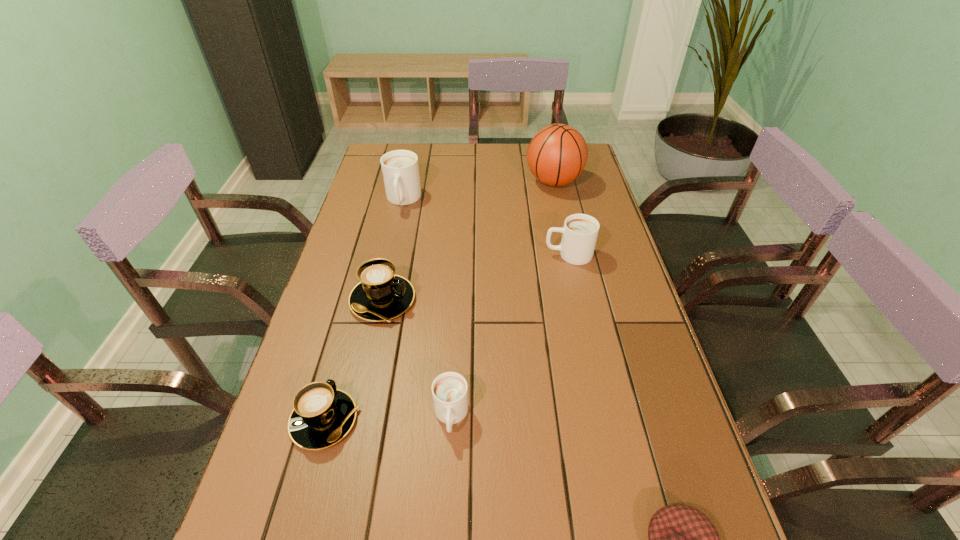
Locate an element on the screen. cappuccino situated at the right edge is located at coordinates (580, 231).

In order to click on object at the far right corner in this screenshot , I will do `click(557, 154)`.

Locate an element on the screen. vacant space at the far edge is located at coordinates (494, 171).

Image resolution: width=960 pixels, height=540 pixels. Find the location of `free space at the left edge`. free space at the left edge is located at coordinates (374, 250).

What are the coordinates of `free space at the right edge of the desktop` in the screenshot? It's located at (588, 306).

The height and width of the screenshot is (540, 960). In the image, there is a desktop. Identify the location of vacant space at the far left corner. (379, 154).

Where is `empty space between the farthest cappuccino and the third farthest object`? empty space between the farthest cappuccino and the third farthest object is located at coordinates (486, 227).

At what (x,y) coordinates should I click in order to perform the action: click on unoccupied position between the third nearest cappuccino and the third farthest object. Please return your answer as a coordinate pair (x, y). Looking at the image, I should click on (475, 278).

Where is `object that stands as the sixth closest to the tallest object`? The image size is (960, 540). object that stands as the sixth closest to the tallest object is located at coordinates (681, 539).

I want to click on object that is the second closest to the second white cappuccino from right to left, so click(x=381, y=295).